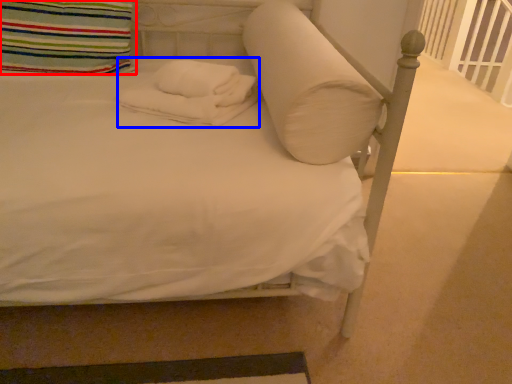
Question: Which object is closer to the camera taking this photo, pillow (highlighted by a red box) or material (highlighted by a blue box)?

Choices:
 (A) pillow
 (B) material

Answer: (B)